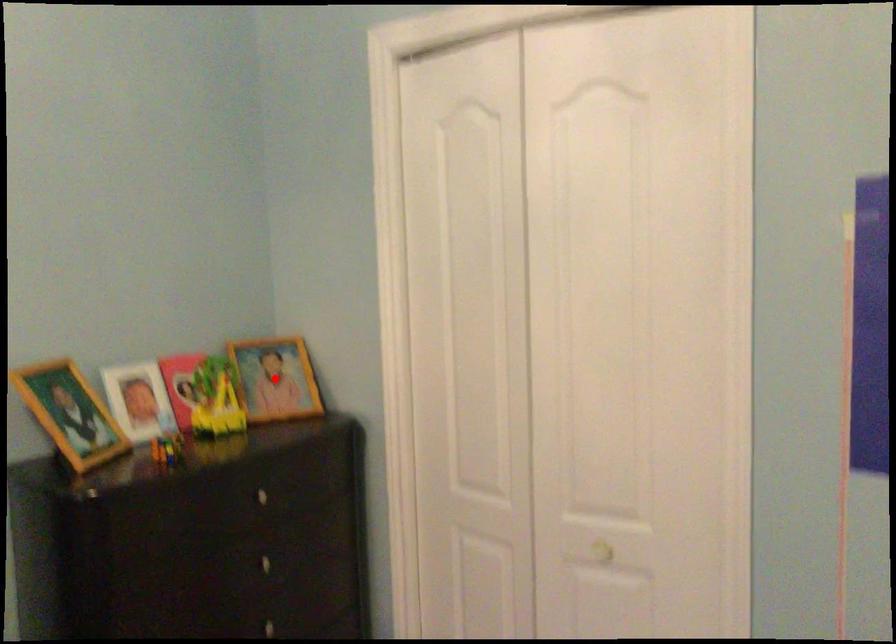
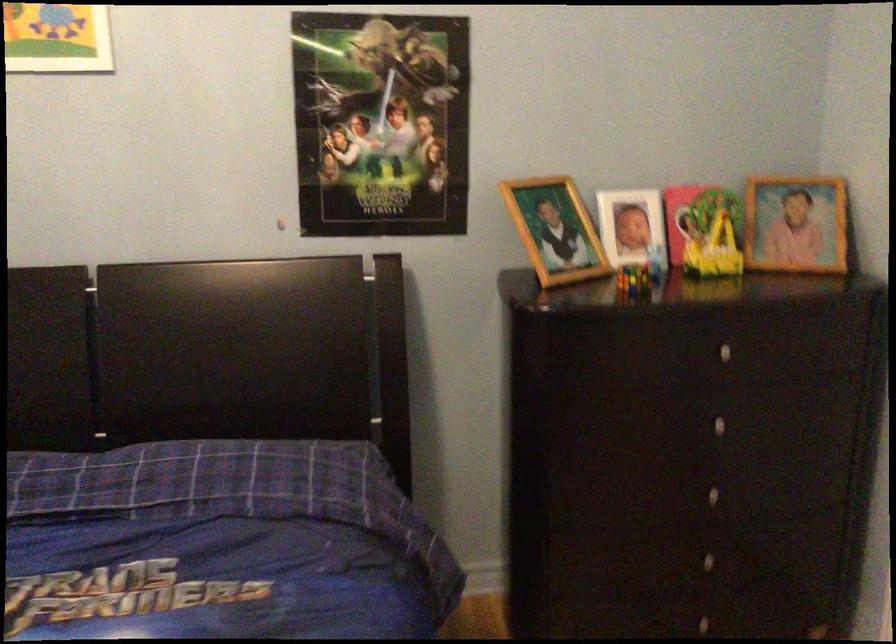
Find the pixel in the second image that matches the highlighted location in the first image.

(796, 223)